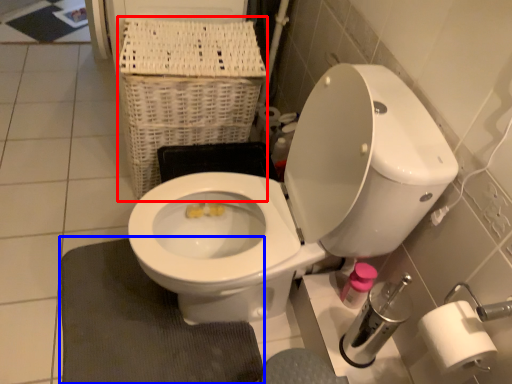
Question: Which of the following is the closest to the observer, basket (highlighted by a red box) or bath mat (highlighted by a blue box)?

Choices:
 (A) basket
 (B) bath mat

Answer: (B)